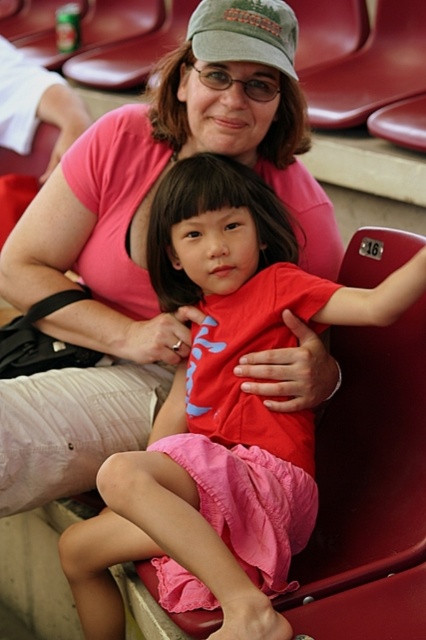
Does pink cotton shirt at center have a greater height compared to red matte shirt at center?

Yes.

Which is more to the right, pink cotton shirt at center or red matte shirt at center?

red matte shirt at center

Between point (129, 360) and point (218, 461), which one is positioned in front?

Point (218, 461)

This screenshot has height=640, width=426. Find the location of `pink cotton shirt at center`. pink cotton shirt at center is located at coordinates (144, 241).

Can you confirm if red matte shirt at center is positioned to the left of green fabric cap at upper center?

Indeed, red matte shirt at center is positioned on the left side of green fabric cap at upper center.

Where is `red matte shirt at center`? red matte shirt at center is located at coordinates (219, 413).

Where is `red matte shirt at center`? red matte shirt at center is located at coordinates (219, 413).

Between pink cotton shirt at center and green fabric cap at upper center, which one appears on the left side from the viewer's perspective?

pink cotton shirt at center

Can you confirm if pink cotton shirt at center is positioned below green fabric cap at upper center?

Yes, pink cotton shirt at center is below green fabric cap at upper center.

Is point (83, 147) farther from camera compared to point (209, 1)?

Yes, point (83, 147) is behind point (209, 1).

Where is `pink cotton shirt at center`? pink cotton shirt at center is located at coordinates (144, 241).